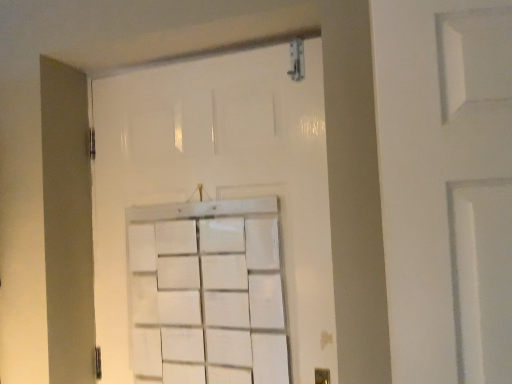
Identify the location of white glossy door at center. The height and width of the screenshot is (384, 512). (218, 177).

The width and height of the screenshot is (512, 384). Describe the element at coordinates (218, 177) in the screenshot. I see `white glossy door at center` at that location.

Locate an element on the screen. This screenshot has height=384, width=512. white glossy door at center is located at coordinates (218, 177).